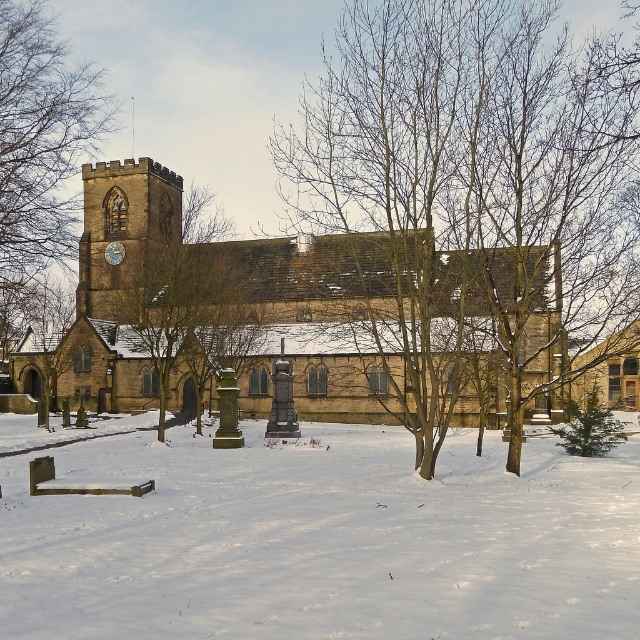
Who is more distant from viewer, (355, 392) or (0, 205)?

The point (355, 392) is behind.

Does brown stone church at center come in front of brown wood tree at upper left?

That is True.

Between point (67, 371) and point (13, 216), which one is positioned behind?

Positioned behind is point (67, 371).

In order to click on brown stone church at center in this screenshot , I will do `click(228, 305)`.

Who is more forward, [104,176] or [188,342]?

Point [188,342] is in front.

Where is `brown stone church at center`? The width and height of the screenshot is (640, 640). brown stone church at center is located at coordinates (228, 305).

What do you see at coordinates (228, 305) in the screenshot? I see `brown stone church at center` at bounding box center [228, 305].

The image size is (640, 640). Find the location of `brown stone church at center`. brown stone church at center is located at coordinates (228, 305).

Locate an element on the screen. The image size is (640, 640). white powdery snow at lower center is located at coordinates (323, 540).

Is point (502, 540) positioned in front of point (182, 257)?

Yes, point (502, 540) is in front of point (182, 257).

Find the location of a particular element. This screenshot has height=640, width=640. white powdery snow at lower center is located at coordinates (323, 540).

This screenshot has height=640, width=640. I want to click on white powdery snow at lower center, so click(323, 540).